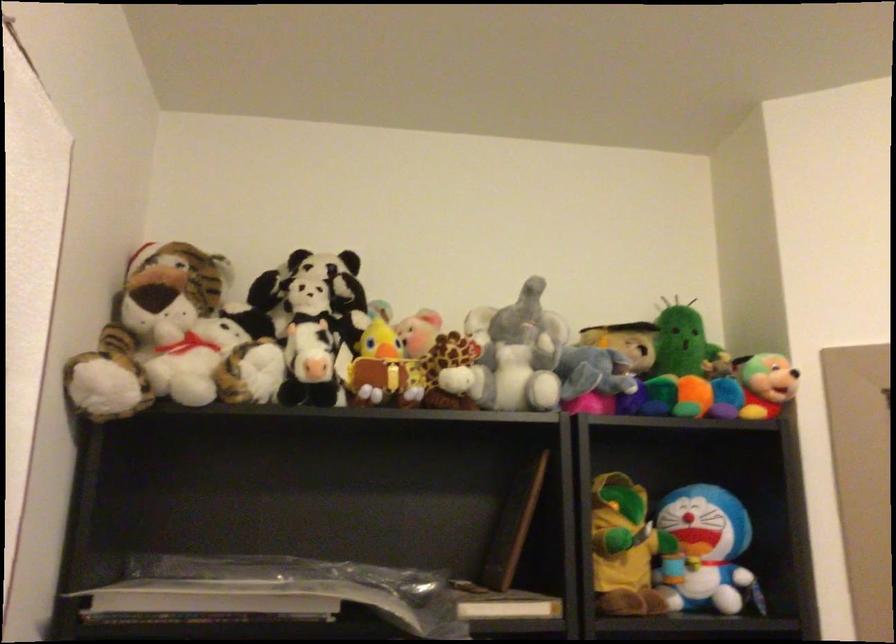
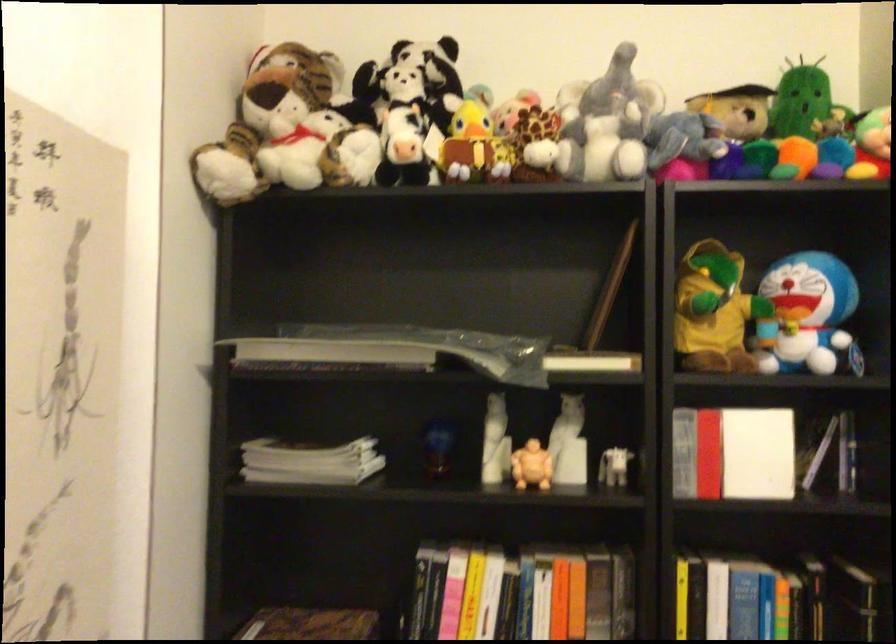
Where in the second image is the point corresponding to point (175, 339) from the first image?

(289, 129)